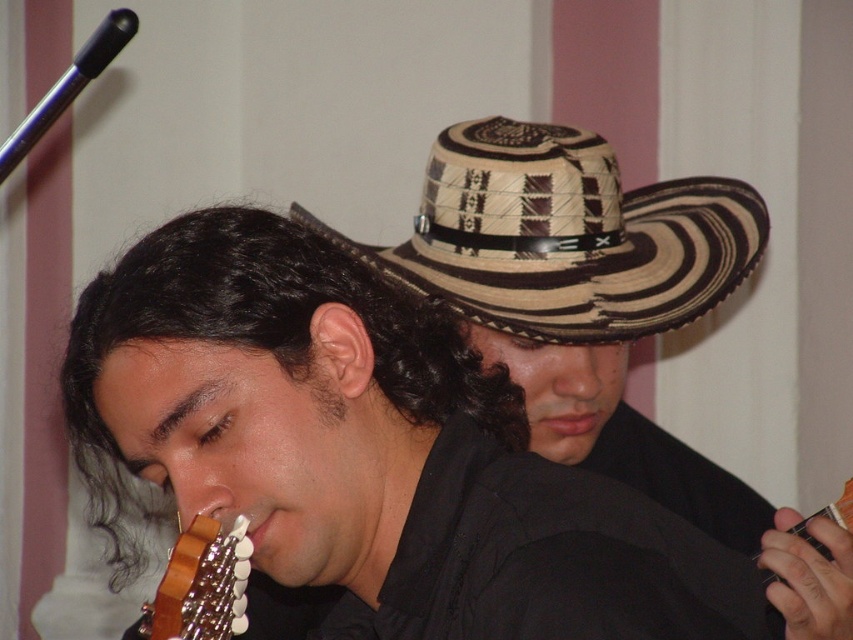
Which is in front, point (495, 180) or point (805, 536)?

Point (805, 536) is in front.

Is brown woven straw cowboy hat at upper center closer to the viewer compared to wooden acoustic guitar at lower right?

No, it is behind wooden acoustic guitar at lower right.

Locate an element on the screen. brown woven straw cowboy hat at upper center is located at coordinates (566, 236).

The width and height of the screenshot is (853, 640). I want to click on brown woven straw cowboy hat at upper center, so click(x=566, y=236).

Who is more distant from viewer, (561, 237) or (250, 552)?

The point (561, 237) is more distant.

Is brown woven straw cowboy hat at upper center wider than wooden acoustic guitar at lower left?

Indeed, brown woven straw cowboy hat at upper center has a greater width compared to wooden acoustic guitar at lower left.

Who is more distant from viewer, (509, 257) or (184, 620)?

The point (509, 257) is more distant.

Identify the location of brown woven straw cowboy hat at upper center. The image size is (853, 640). (566, 236).

Which is below, wooden acoustic guitar at lower left or wooden acoustic guitar at lower right?

wooden acoustic guitar at lower left

Is point (151, 616) positioned after point (846, 504)?

No.

Identify the location of wooden acoustic guitar at lower left. The width and height of the screenshot is (853, 640). (201, 584).